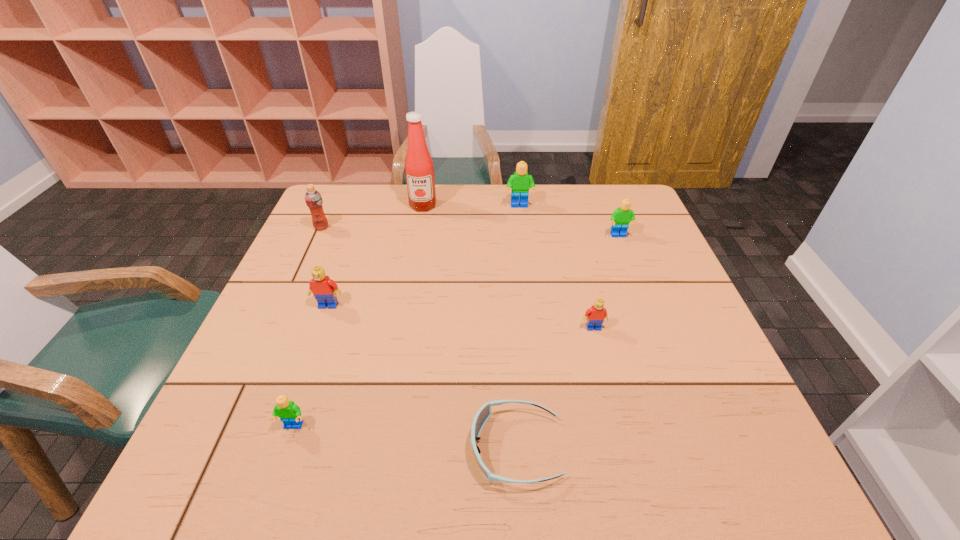
Where is `free space located 0.350m on the face of the smaller red Lego`? The image size is (960, 540). free space located 0.350m on the face of the smaller red Lego is located at coordinates (634, 487).

Locate an element on the screen. blank area located on the front-facing side of the shortest object is located at coordinates (366, 448).

Identify the location of free point located on the front-facing side of the shortest object. (311, 448).

This screenshot has height=540, width=960. In order to click on free point located on the front-facing side of the shortest object in this screenshot , I will do `click(323, 448)`.

The width and height of the screenshot is (960, 540). I want to click on condiment situated at the far edge, so click(x=419, y=168).

Identify the location of Lego that is at the far edge. (520, 182).

The height and width of the screenshot is (540, 960). What are the coordinates of `orange juice that is positioned at the far edge` in the screenshot? It's located at (313, 199).

Find the location of a particular element. object located at the near edge is located at coordinates (483, 414).

Where is `orange juice that is at the left edge`? The height and width of the screenshot is (540, 960). orange juice that is at the left edge is located at coordinates (313, 199).

Where is `object at the right edge`? object at the right edge is located at coordinates (620, 218).